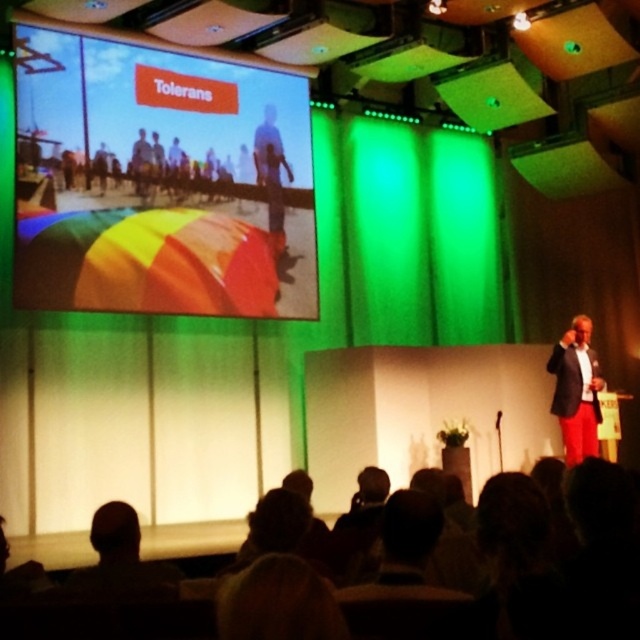
Question: In this image, where is rainbow fabric umbrella at upper left located relative to matte black suit at right?

Choices:
 (A) right
 (B) left

Answer: (B)

Question: Is rainbow fabric umbrella at upper left wider than matte black suit at right?

Choices:
 (A) yes
 (B) no

Answer: (A)

Question: Can you confirm if rainbow fabric umbrella at upper left is positioned above matte black suit at right?

Choices:
 (A) no
 (B) yes

Answer: (B)

Question: Which of the following is the farthest from the observer?

Choices:
 (A) rainbow fabric umbrella at upper left
 (B) matte black suit at right

Answer: (B)

Question: Among these objects, which one is nearest to the camera?

Choices:
 (A) matte black suit at right
 (B) rainbow fabric umbrella at upper left

Answer: (B)